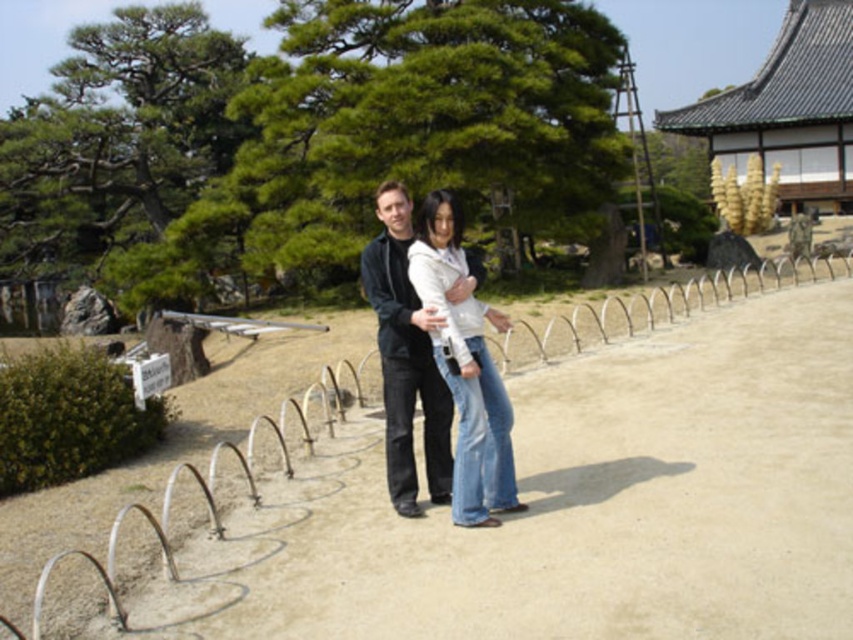
Can you confirm if white matte jacket at center is bigger than dark gray sweater at center?

Yes, white matte jacket at center is bigger than dark gray sweater at center.

Between white matte jacket at center and dark gray sweater at center, which one has less height?

With less height is white matte jacket at center.

Is point (486, 353) farther from viewer compared to point (410, 458)?

No, it is not.

Where is `white matte jacket at center`? white matte jacket at center is located at coordinates (465, 369).

From the picture: Is silver wire fence at center further to camera compared to white matte jacket at center?

Answer: No, it is in front of white matte jacket at center.

This screenshot has height=640, width=853. I want to click on silver wire fence at center, so click(x=519, y=486).

Does silver wire fence at center have a greater width compared to dark gray sweater at center?

Yes.

Is point (776, 483) closer to camera compared to point (384, 266)?

No, (776, 483) is further to viewer.

This screenshot has height=640, width=853. I want to click on silver wire fence at center, so click(519, 486).